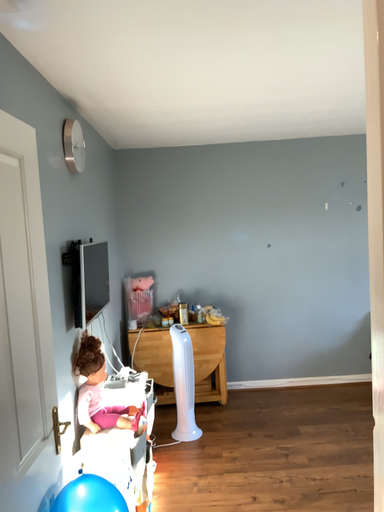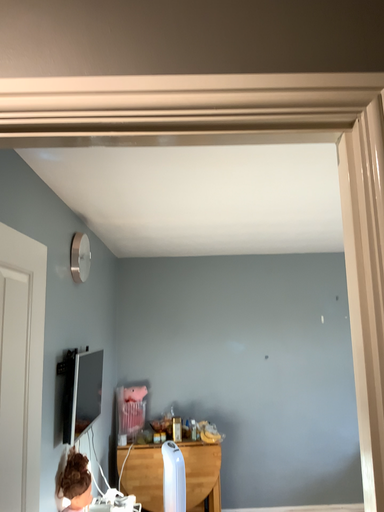
Question: How did the camera likely rotate when shooting the video?

Choices:
 (A) rotated upward
 (B) rotated downward

Answer: (A)